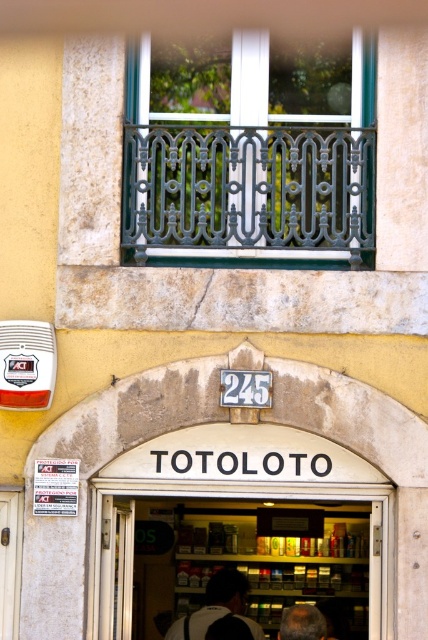
Is metallic glass door at center bigger than gray hair at lower center?

Yes, metallic glass door at center is bigger than gray hair at lower center.

Can you confirm if metallic glass door at center is thinner than gray hair at lower center?

In fact, metallic glass door at center might be wider than gray hair at lower center.

Does point (377, 621) come behind point (309, 620)?

No, it is not.

At what (x,y) coordinates should I click in order to perform the action: click on metallic glass door at center. Please return your answer as a coordinate pair (x, y). This screenshot has height=640, width=428. Looking at the image, I should click on (237, 561).

Is wooden door at lower left below dark gray backpack at center?

Actually, wooden door at lower left is above dark gray backpack at center.

Is wooden door at lower left to the right of dark gray backpack at center from the viewer's perspective?

A: In fact, wooden door at lower left is to the left of dark gray backpack at center.

Based on the photo, who is more forward, (5, 618) or (222, 609)?

Point (5, 618) is in front.

Identify the location of wooden door at lower left. (9, 560).

Is dark gray backpack at center taller than gray hair at lower center?

Correct, dark gray backpack at center is much taller as gray hair at lower center.

Does dark gray backpack at center have a greater width compared to gray hair at lower center?

Yes, dark gray backpack at center is wider than gray hair at lower center.

Is point (225, 611) positioned after point (294, 618)?

That is True.

The width and height of the screenshot is (428, 640). Find the location of `dark gray backpack at center`. dark gray backpack at center is located at coordinates [x=216, y=605].